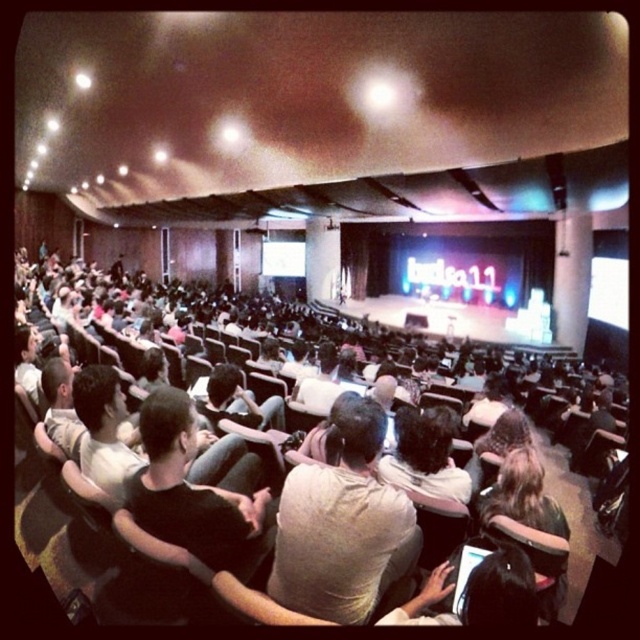
Question: Which object appears farthest from the camera in this image?

Choices:
 (A) light brown cotton shirt at center
 (B) light brown hair at center

Answer: (B)

Question: Observing the image, what is the correct spatial positioning of light brown cotton shirt at center in reference to light brown hair at center?

Choices:
 (A) left
 (B) right

Answer: (A)

Question: Which point is farther from the camera taking this photo?

Choices:
 (A) 420,442
 (B) 296,541

Answer: (A)

Question: From the image, what is the correct spatial relationship of light brown cotton shirt at center in relation to light brown hair at center?

Choices:
 (A) below
 (B) above

Answer: (A)

Question: Among these points, which one is farthest from the camera?

Choices:
 (A) (428, 465)
 (B) (332, 589)

Answer: (A)

Question: Does light brown cotton shirt at center appear on the left side of light brown hair at center?

Choices:
 (A) yes
 (B) no

Answer: (A)